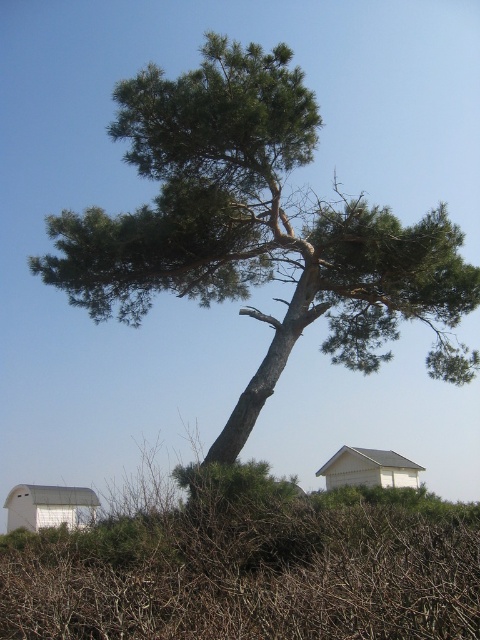
Based on the photo, you are planning to plant a new tree in your backyard. You have a brown dry bush at center and a white matte house at center in your yard. Which object takes up more space?

The brown dry bush at center has a larger size compared to the white matte house at center, so the brown dry bush at center takes up more space.

Looking at this image, you are a gardener planning to plant a new flower bed between the brown dry bush at center and the white matte house at center. Based on their heights, which object should you place closer to the front of the flower bed to ensure both are visible?

The brown dry bush at center is taller than the white matte house at center, so you should place the white matte house at center closer to the front of the flower bed to ensure both are visible.